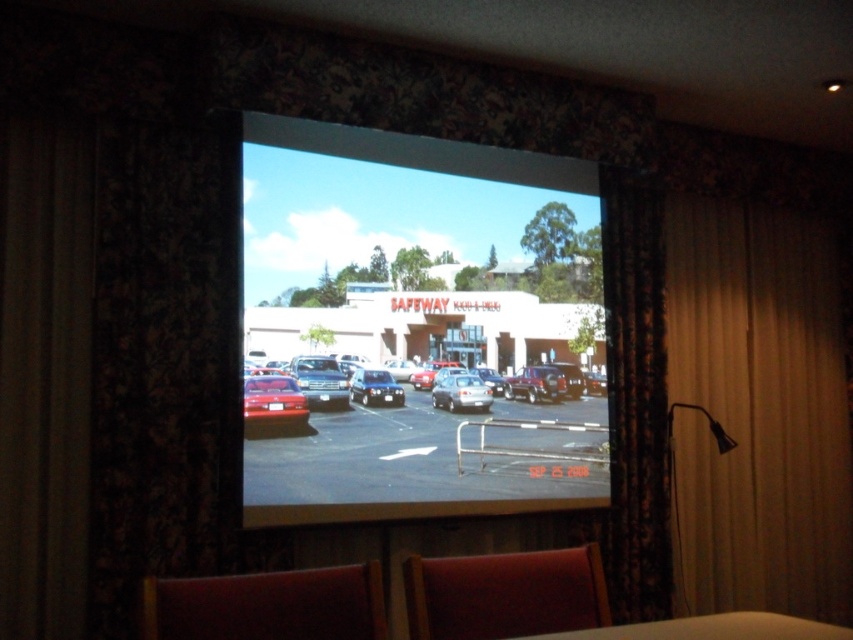
Question: Is the position of shiny silver sedan at center more distant than that of shiny blue sedan at center?

Choices:
 (A) no
 (B) yes

Answer: (B)

Question: From the image, what is the correct spatial relationship of matte red car at center in relation to silver metallic sedan at center?

Choices:
 (A) below
 (B) above

Answer: (A)

Question: Which point is closer to the camera?

Choices:
 (A) (766, 627)
 (B) (256, 417)
 (C) (183, 577)
 (D) (635, 440)

Answer: (A)

Question: Among these objects, which one is nearest to the camera?

Choices:
 (A) matte red car at center
 (B) shiny silver sedan at center
 (C) metallic silver cars at center
 (D) dark velvet curtain at left

Answer: (D)

Question: Does matte wood table at center have a greater width compared to shiny silver sedan at center?

Choices:
 (A) yes
 (B) no

Answer: (A)

Question: Which point appears farthest from the camera in this image?

Choices:
 (A) (405, 561)
 (B) (677, 625)
 (C) (363, 371)

Answer: (A)